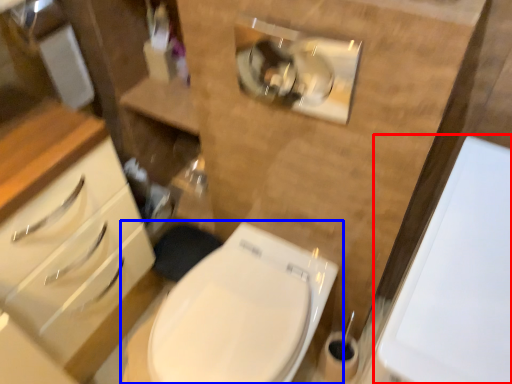
Question: Which of the following is the farthest to the observer, porcelain (highlighted by a red box) or toilet (highlighted by a blue box)?

Choices:
 (A) porcelain
 (B) toilet

Answer: (B)